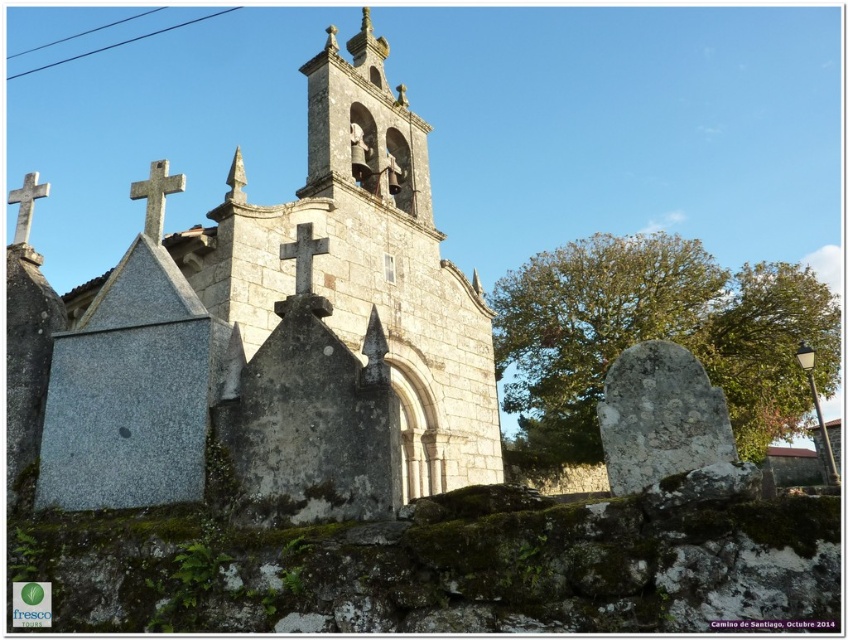
You are standing at the entrance of the small stone church and want to visit the gray stone gravestone at center. According to the coordinates provided, in which direction should you walk from the church to reach the gravestone?

The gray stone gravestone at center is located at point (659,417), which means it is positioned to the lower right of the church. Therefore, you should walk towards the lower right direction from the church to reach the gravestone.

You are standing in front of the church and want to place a new flowerpot between the gray stone gravestone at center and the white stone cross at upper center. Based on their heights, which object should the flowerpot be placed closer to?

The gray stone gravestone at center is not as tall as the white stone cross at upper center, so the flowerpot should be placed closer to the gray stone gravestone at center since it is shorter.

You are standing in front of the granite church at center and want to take a photo of the white stone cross at upper left. In which direction should you move to get the cross into your camera frame?

You should move to your left because the granite church at center is to the right of the white stone cross at upper left, so moving left will bring the cross into view.